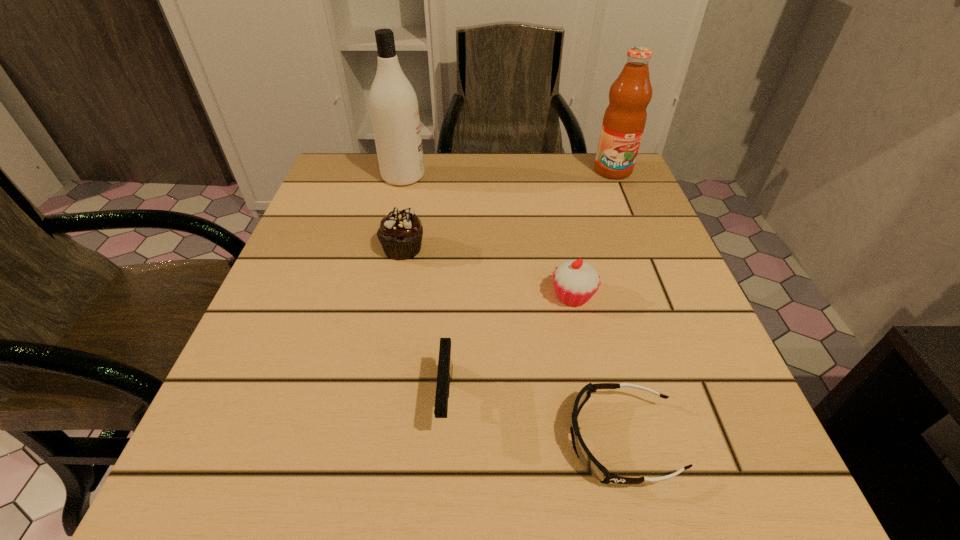
Find the location of a particular element. This screenshot has width=960, height=540. vacant space that's between the second tallest object and the right cupcake is located at coordinates (593, 233).

The width and height of the screenshot is (960, 540). Find the location of `free point between the shampoo and the pistol`. free point between the shampoo and the pistol is located at coordinates (424, 288).

The width and height of the screenshot is (960, 540). Identify the location of free area in between the third nearest object and the farther cupcake. (488, 273).

Select which object is the second closest to the rightmost object. Please provide its 2D coordinates. Your answer should be formatted as a tuple, i.e. [(x, y)], where the tuple contains the x and y coordinates of a point satisfying the conditions above.

[(393, 103)]

Locate an element on the screen. This screenshot has height=540, width=960. the closest object to the fourth nearest object is located at coordinates (393, 103).

Locate an element on the screen. This screenshot has width=960, height=540. vacant space that satisfies the following two spatial constraints: 1. on the front-facing side of the farther cupcake; 2. on the right side of the shampoo is located at coordinates (387, 249).

Locate an element on the screen. This screenshot has width=960, height=540. free region that satisfies the following two spatial constraints: 1. on the front-facing side of the farther cupcake; 2. on the right side of the shampoo is located at coordinates pyautogui.click(x=387, y=249).

This screenshot has height=540, width=960. I want to click on vacant region that satisfies the following two spatial constraints: 1. on the front-facing side of the nearer cupcake; 2. on the left side of the shampoo, so click(375, 296).